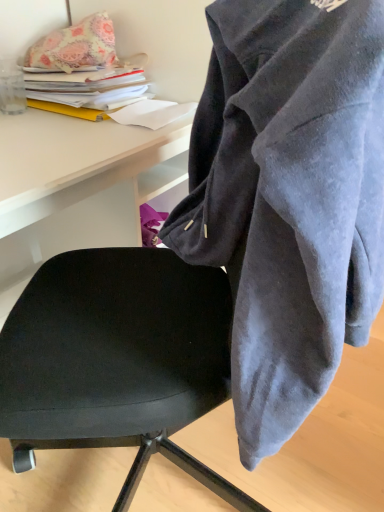
Measure the distance between point (x=81, y=383) and camera.

The depth of point (x=81, y=383) is 66.30 centimeters.

Identify the location of velvet gray hoodie at center. (289, 198).

Is floral fabric pillow at upper left far away from black leather chair at center?

No, floral fabric pillow at upper left is in close proximity to black leather chair at center.

Considering the sizes of floral fabric pillow at upper left and black leather chair at center in the image, is floral fabric pillow at upper left bigger or smaller than black leather chair at center?

In the image, floral fabric pillow at upper left appears to be smaller than black leather chair at center.

From a real-world perspective, is floral fabric pillow at upper left positioned above or below black leather chair at center?

floral fabric pillow at upper left is situated higher than black leather chair at center in the real world.

How far apart are velvet gray hoodie at center and black leather chair at center?

velvet gray hoodie at center is 25.56 centimeters from black leather chair at center.

Can you see velvet gray hoodie at center touching black leather chair at center?

No.

In the scene shown: Is velvet gray hoodie at center looking in the opposite direction of black leather chair at center?

No, velvet gray hoodie at center is not facing the opposite direction of black leather chair at center.

Which is correct: velvet gray hoodie at center is inside black leather chair at center, or outside of it?

velvet gray hoodie at center is spatially situated outside black leather chair at center.

Is floral fabric pillow at upper left wider or thinner than velvet gray hoodie at center?

floral fabric pillow at upper left is thinner than velvet gray hoodie at center.

Considering the relative positions of floral fabric pillow at upper left and velvet gray hoodie at center in the image provided, is floral fabric pillow at upper left to the right of velvet gray hoodie at center from the viewer's perspective?

No.

Based on the photo, who is bigger, floral fabric pillow at upper left or velvet gray hoodie at center?

With larger size is velvet gray hoodie at center.

Consider the image. Is velvet gray hoodie at center far away from floral fabric pillow at upper left?

Actually, velvet gray hoodie at center and floral fabric pillow at upper left are a little close together.

Is velvet gray hoodie at center oriented towards floral fabric pillow at upper left?

No, velvet gray hoodie at center does not turn towards floral fabric pillow at upper left.

Where is `pillow behind the velvet gray hoodie at center`? The height and width of the screenshot is (512, 384). pillow behind the velvet gray hoodie at center is located at coordinates (74, 47).

Which of these two, velvet gray hoodie at center or floral fabric pillow at upper left, stands taller?

velvet gray hoodie at center is taller.

In the scene shown: Is black leather chair at center far from floral fabric pillow at upper left?

That's not correct — black leather chair at center is a little close to floral fabric pillow at upper left.

From a real-world perspective, is black leather chair at center below floral fabric pillow at upper left?

Indeed, from a real-world perspective, black leather chair at center is positioned beneath floral fabric pillow at upper left.

From the image's perspective, would you say black leather chair at center is positioned over velvet gray hoodie at center?

Incorrect, from the image's perspective, black leather chair at center is lower than velvet gray hoodie at center.

This screenshot has width=384, height=512. Find the location of `chair behind the velvet gray hoodie at center`. chair behind the velvet gray hoodie at center is located at coordinates click(x=117, y=360).

Is point (222, 490) farther from viewer compared to point (341, 178)?

Yes, it is.

Is black leather chair at center aimed at velvet gray hoodie at center?

Yes, black leather chair at center faces towards velvet gray hoodie at center.

Where is `chair on the left of the floral fabric pillow at upper left`? chair on the left of the floral fabric pillow at upper left is located at coordinates (117, 360).

In the image, there is a velvet gray hoodie at center. Where is `chair below it (from the image's perspective)`? This screenshot has height=512, width=384. chair below it (from the image's perspective) is located at coordinates (117, 360).

From the image, which object appears to be farther from velvet gray hoodie at center, floral fabric pillow at upper left or black leather chair at center?

floral fabric pillow at upper left lies further to velvet gray hoodie at center than the other object.

In the scene shown: Looking at the image, which one is located closer to floral fabric pillow at upper left, black leather chair at center or velvet gray hoodie at center?

The object closer to floral fabric pillow at upper left is black leather chair at center.

When comparing their distances from floral fabric pillow at upper left, does velvet gray hoodie at center or black leather chair at center seem closer?

black leather chair at center is positioned closer to the anchor floral fabric pillow at upper left.

When comparing their distances from velvet gray hoodie at center, does black leather chair at center or floral fabric pillow at upper left seem closer?

black leather chair at center is closer to velvet gray hoodie at center.

Looking at the image, which one is located closer to black leather chair at center, floral fabric pillow at upper left or velvet gray hoodie at center?

The object closer to black leather chair at center is velvet gray hoodie at center.

Looking at the image, which one is located further to black leather chair at center, velvet gray hoodie at center or floral fabric pillow at upper left?

floral fabric pillow at upper left lies further to black leather chair at center than the other object.

You are a GUI agent. You are given a task and a screenshot of the screen. Output one action in this format:
    pyautogui.click(x=<x>, y=<y>)
    Task: Click on the chair between velvet gray hoodie at center and floral fabric pillow at upper left from front to back
    Image resolution: width=384 pixels, height=512 pixels.
    Given the screenshot: What is the action you would take?
    pyautogui.click(x=117, y=360)